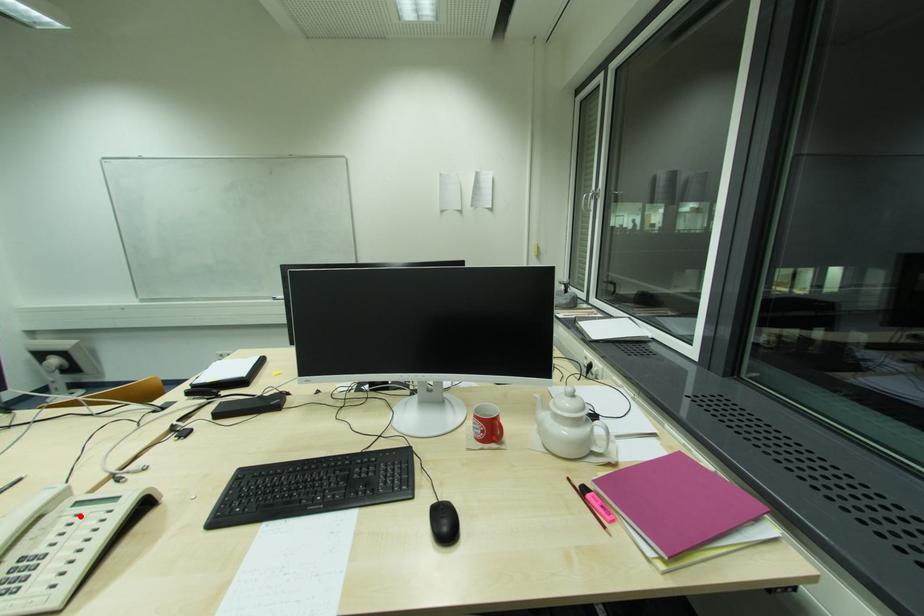
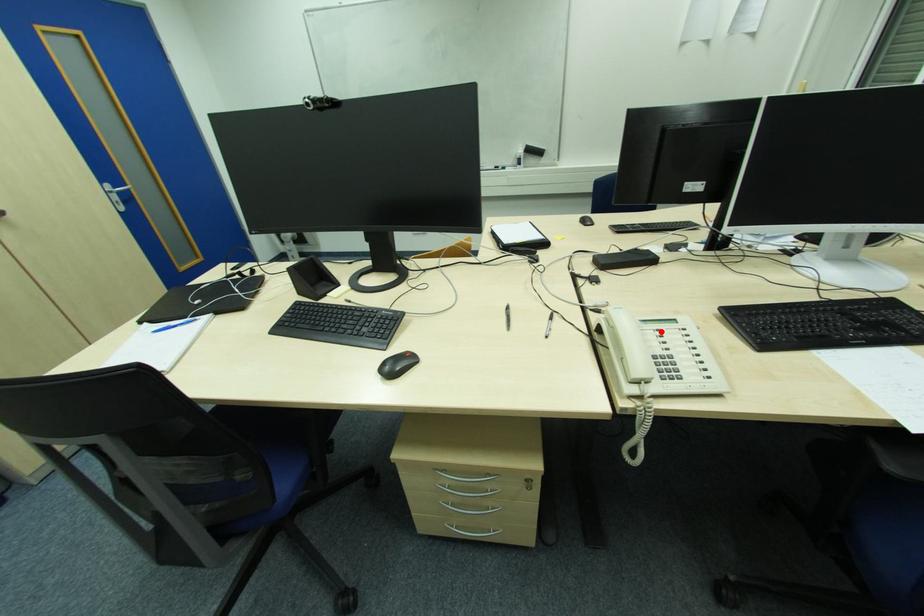
I am providing you with two images of the same scene from different viewpoints. A red point is marked on the first image and another point is marked on the second image. Is the marked point in image1 the same physical position as the marked point in image2?

Yes